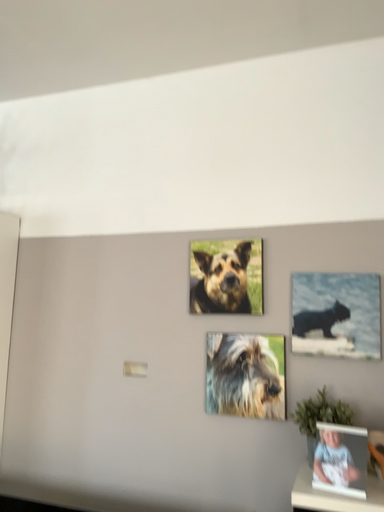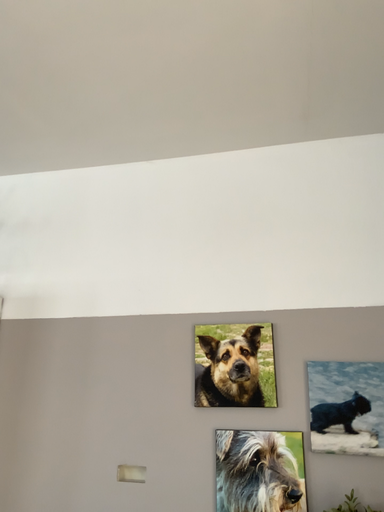
Question: How did the camera likely rotate when shooting the video?

Choices:
 (A) rotated upward
 (B) rotated downward

Answer: (A)